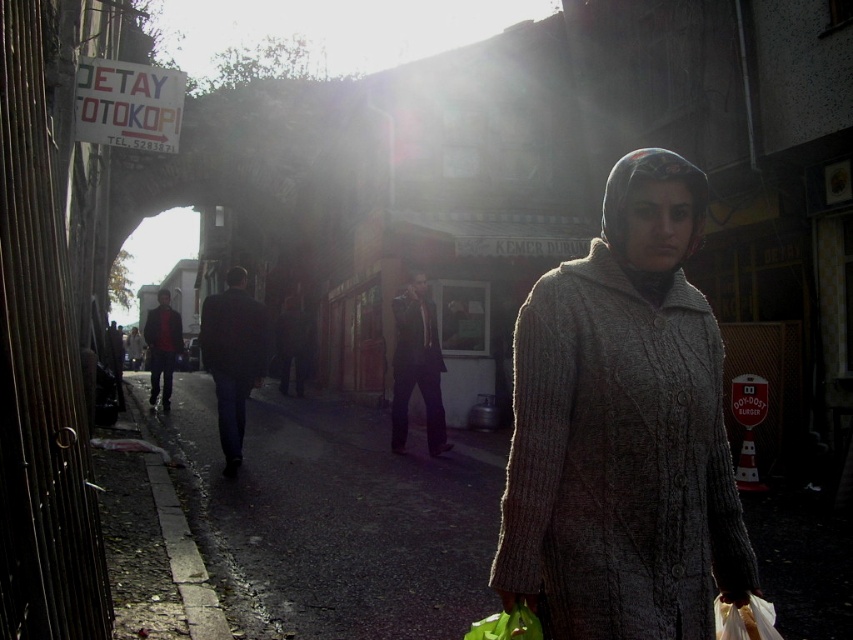
A person wearing a dark blue suit at center is standing on the sidewalk. A streetlight is located 8.07 meters away from them. If the person walks towards the streetlight at a speed of 1.5 meters per second, how many seconds will it take for them to reach the streetlight?

The person wearing a dark blue suit at center is 8.07 meters away from the streetlight. Walking at 1.5 meters per second, it would take them 8.07 divided by 1.5, which equals approximately 5.38 seconds to reach the streetlight.

You are standing at the point with coordinates point (160, 364) and want to walk to the point with coordinates point (616, 413). Which direction should you move relative to the street scene?

You should move forward towards point (616, 413) because it is in front of point (160, 364) in the street scene.